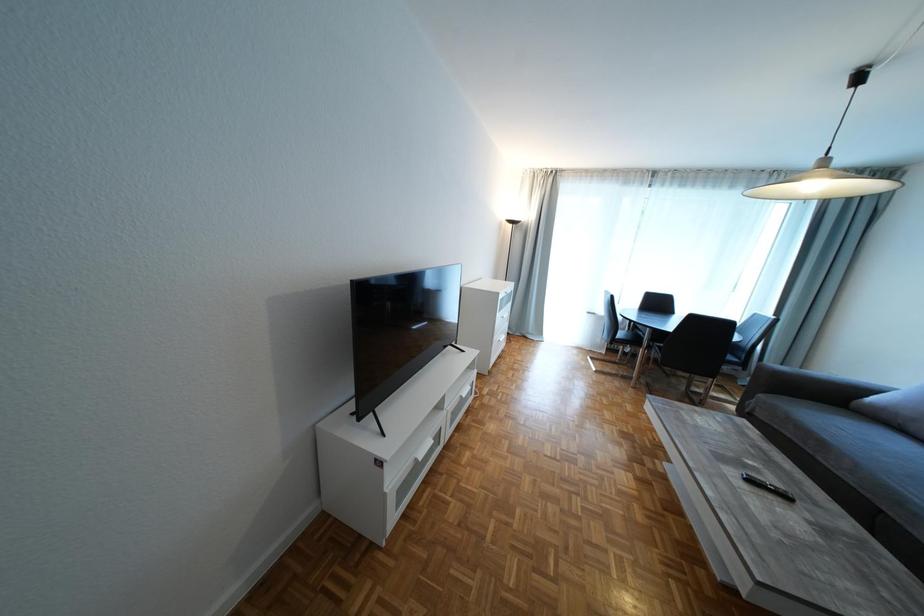
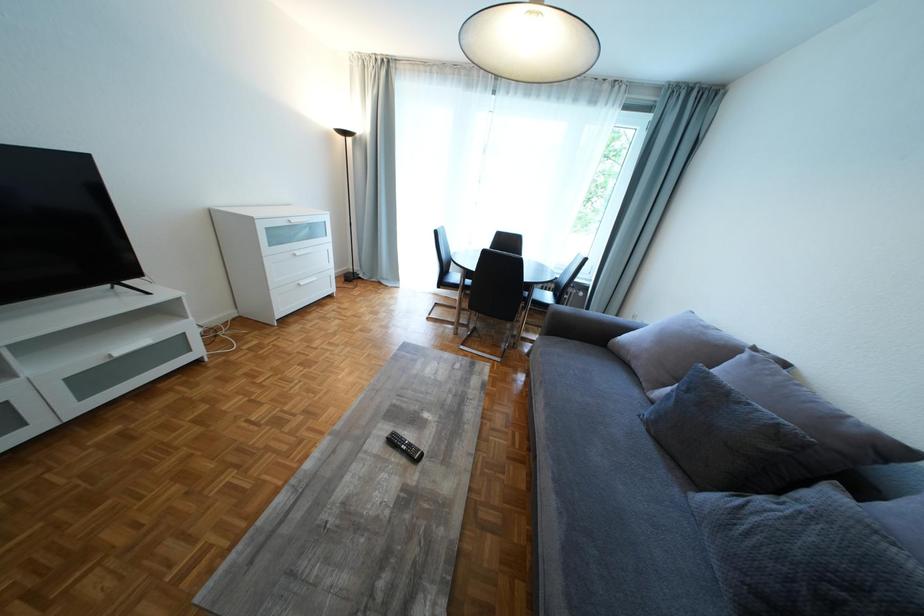
Question: The images are taken continuously from a first-person perspective. In which direction are you moving?

Choices:
 (A) Left
 (B) Right
 (C) Forward
 (D) Backward

Answer: (B)